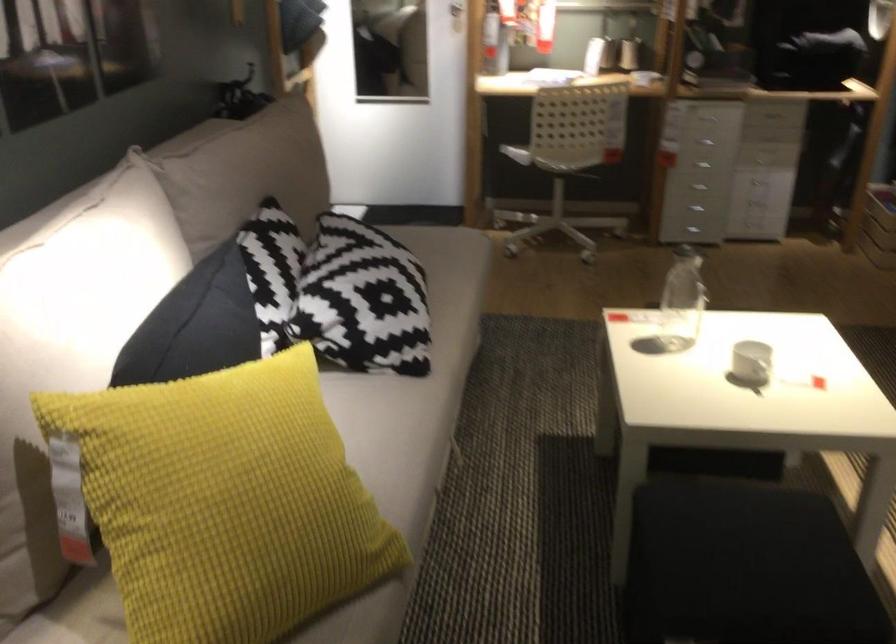
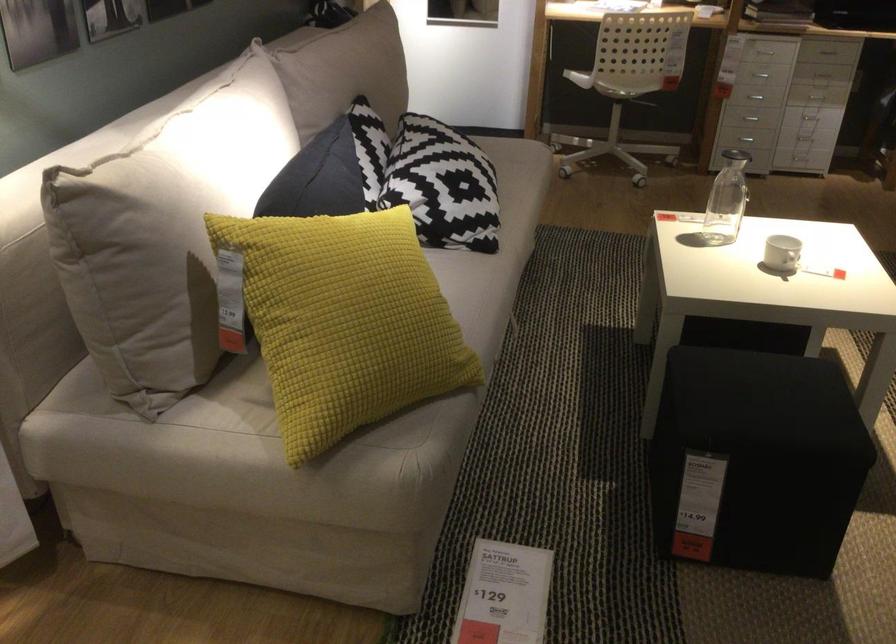
In the second image, find the point that corresponds to (572,158) in the first image.

(627, 80)